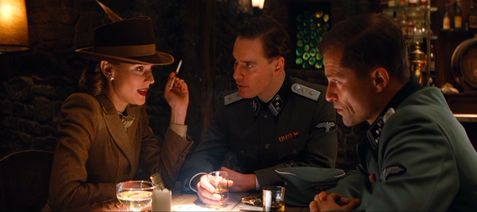
You are a GUI agent. You are given a task and a screenshot of the screen. Output one action in this format:
    pyautogui.click(x=<x>, y=<y>)
    Task: Click on the light
    
    Given the screenshot: What is the action you would take?
    pyautogui.click(x=6, y=11)